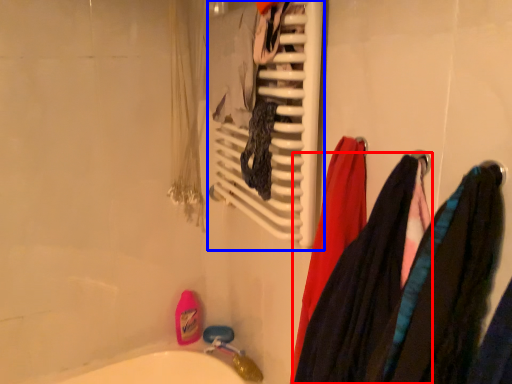
Question: Among these objects, which one is nearest to the camera, clothing (highlighted by a red box) or towel rack (highlighted by a blue box)?

Choices:
 (A) clothing
 (B) towel rack

Answer: (A)